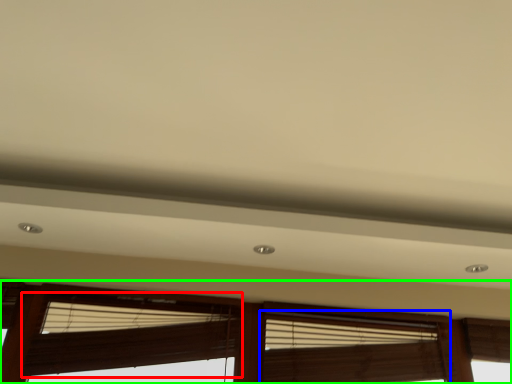
Question: Considering the real-world distances, which object is farthest from window blind (highlighted by a red box)? window blind (highlighted by a blue box) or window (highlighted by a green box)?

Choices:
 (A) window blind
 (B) window

Answer: (A)